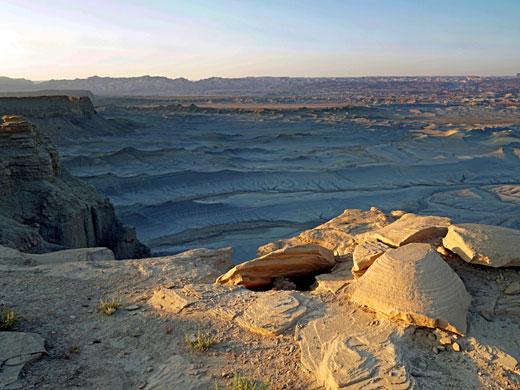
Find the location of a particular element. Image resolution: width=520 pixels, height=390 pixels. light is located at coordinates (393, 286).